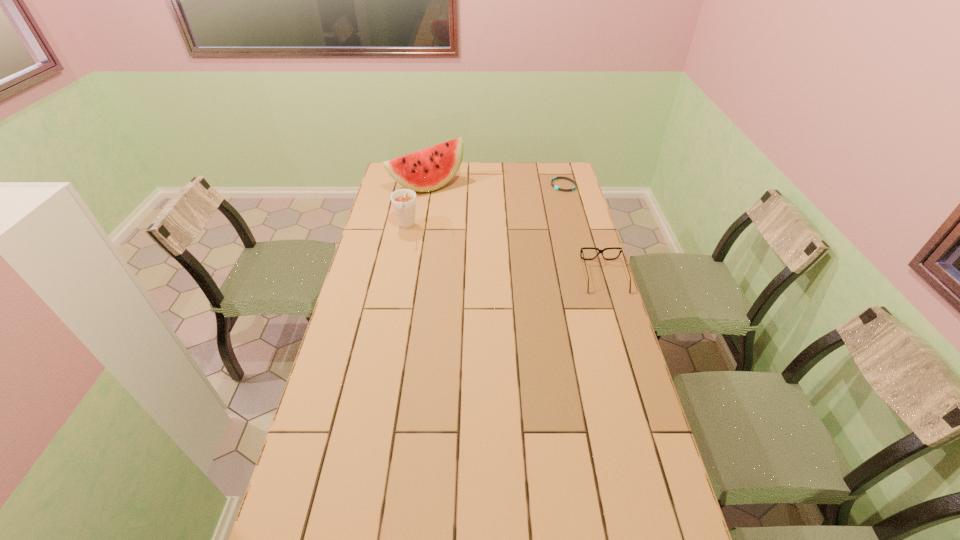
What are the coordinates of `vacant point located 0.200m on the buckle of the wristband` in the screenshot? It's located at (535, 210).

Image resolution: width=960 pixels, height=540 pixels. In order to click on vacant space located 0.350m on the buckle of the wristband in this screenshot , I will do pos(516,226).

This screenshot has width=960, height=540. I want to click on free region located 0.070m on the buckle of the wristband, so click(x=549, y=197).

Locate an element on the screen. The image size is (960, 540). watermelon that is at the far edge is located at coordinates (429, 169).

At what (x,y) coordinates should I click in order to perform the action: click on wristband at the far edge. Please return your answer as a coordinate pair (x, y). This screenshot has height=540, width=960. Looking at the image, I should click on (555, 187).

This screenshot has height=540, width=960. I want to click on root beer located in the left edge section of the desktop, so click(x=403, y=200).

Where is `watermelon that is at the left edge`? The width and height of the screenshot is (960, 540). watermelon that is at the left edge is located at coordinates (429, 169).

This screenshot has height=540, width=960. I want to click on spectacles that is at the right edge, so click(581, 251).

Find the location of a particular element. This screenshot has height=540, width=960. wristband that is at the right edge is located at coordinates (555, 187).

Locate an element on the screen. This screenshot has width=960, height=540. object that is positioned at the far left corner is located at coordinates (429, 169).